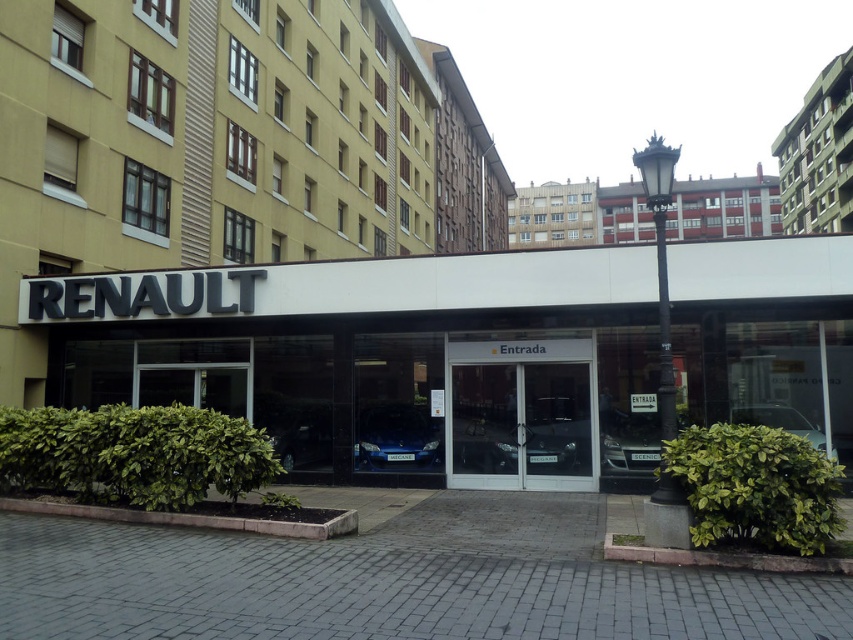
Question: Which of the following is the closest to the observer?

Choices:
 (A) transparent glass door at center
 (B) metallic blue car at center
 (C) satin blue car at center

Answer: (B)

Question: Is concrete building at upper right to the right of metallic blue car at center from the viewer's perspective?

Choices:
 (A) yes
 (B) no

Answer: (A)

Question: Where is white glossy sign at center located in relation to concrete building at upper right in the image?

Choices:
 (A) right
 (B) left

Answer: (B)

Question: Which of the following is the closest to the observer?

Choices:
 (A) white glossy sign at center
 (B) silver metallic sedan at center
 (C) transparent glass door at center
 (D) metallic blue car at center

Answer: (A)

Question: Is the position of white glossy sign at center more distant than that of concrete building at upper right?

Choices:
 (A) no
 (B) yes

Answer: (A)

Question: Which of the following is the farthest from the observer?

Choices:
 (A) silver metallic sedan at center
 (B) light brown wooden building at upper center
 (C) red brick building at upper center
 (D) transparent glass door at center

Answer: (B)